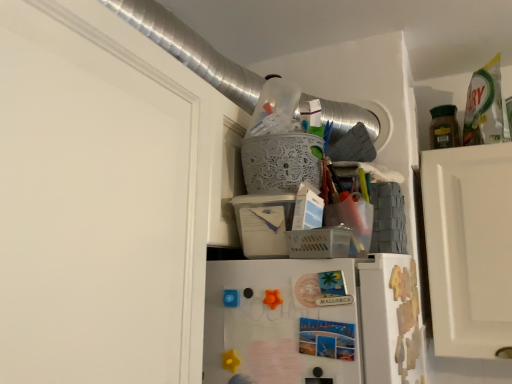
Question: Considering the positions of white lace basket at upper center, acting as the second basket starting from the bottom, and plastic/mesh basket at upper center, which is the first basket in bottom-to-top order, in the image, is white lace basket at upper center, acting as the second basket starting from the bottom, bigger or smaller than plastic/mesh basket at upper center, which is the first basket in bottom-to-top order,?

Choices:
 (A) small
 (B) big

Answer: (B)

Question: From a real-world perspective, is white lace basket at upper center, acting as the second basket starting from the bottom, positioned above or below plastic/mesh basket at upper center, which is the first basket in bottom-to-top order?

Choices:
 (A) above
 (B) below

Answer: (A)

Question: Considering the real-world distances, which object is farthest from the green matte jar at upper right?

Choices:
 (A) plastic/mesh basket at upper center, which is the first basket in bottom-to-top order
 (B) white lace basket at upper center, which appears as the 1th basket when viewed from the top

Answer: (A)

Question: Which object is the closest to the plastic/mesh basket at upper center, which is the first basket in bottom-to-top order?

Choices:
 (A) green matte jar at upper right
 (B) white lace basket at upper center, acting as the second basket starting from the bottom

Answer: (B)